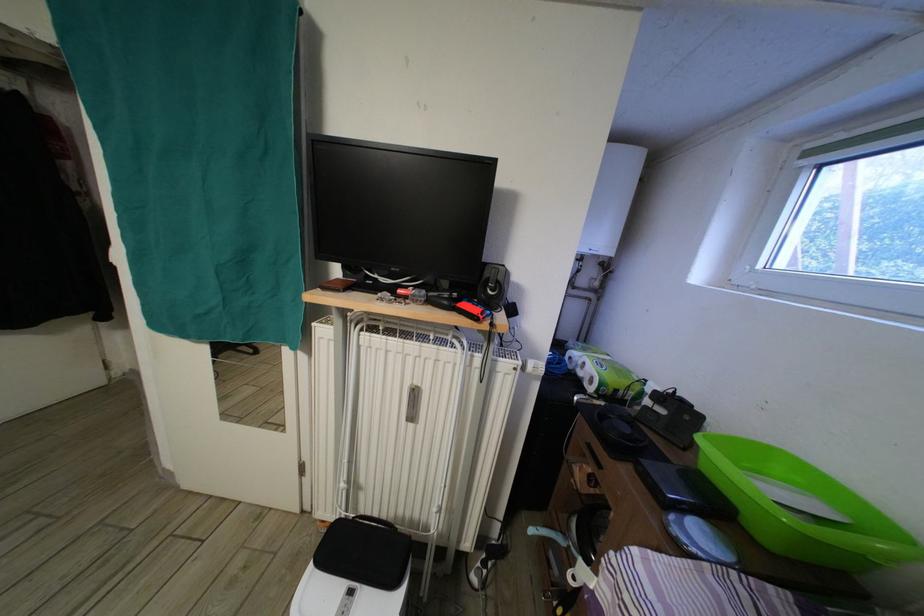
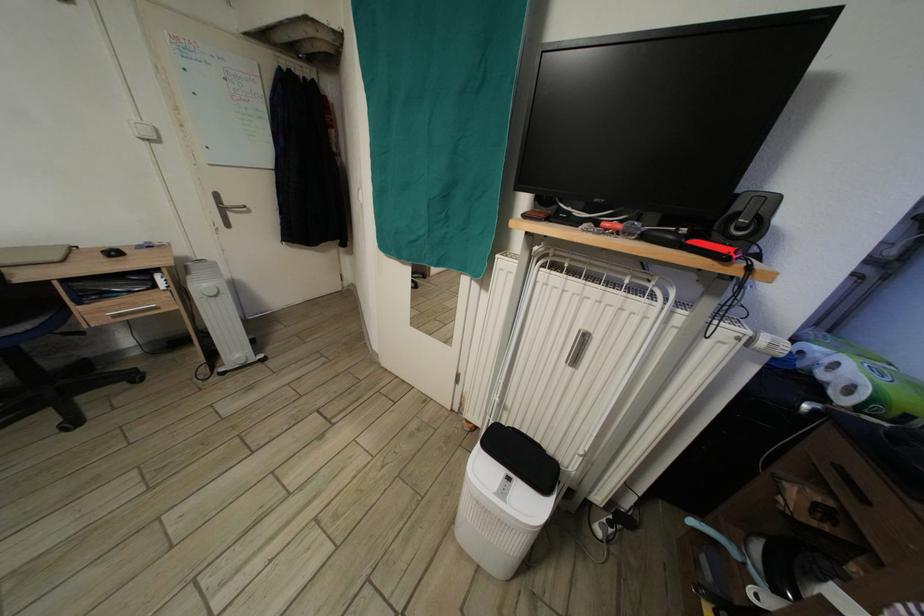
The point at (383, 283) is marked in the first image. Where is the corresponding point in the second image?

(576, 216)